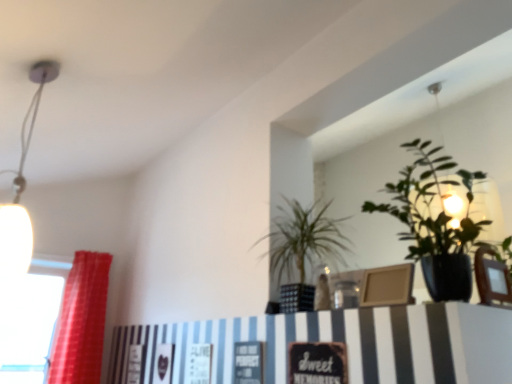
Question: Is red fabric curtain at left taller or shorter than transparent glass window at left?

Choices:
 (A) short
 (B) tall

Answer: (B)

Question: From a real-world perspective, is red fabric curtain at left physically located above or below transparent glass window at left?

Choices:
 (A) below
 (B) above

Answer: (B)

Question: Estimate the real-world distances between objects in this image. Which object is closer to the green glossy plant at upper right, arranged as the 2th houseplant when viewed from the left?

Choices:
 (A) transparent glass window at left
 (B) white glossy lamp at upper left
 (C) green leafy plant at center, the second houseplant from the right
 (D) red fabric curtain at left

Answer: (C)

Question: Based on their relative distances, which object is nearer to the red fabric curtain at left?

Choices:
 (A) green leafy plant at center, the first houseplant from the left
 (B) green glossy plant at upper right, which ranks as the first houseplant in right-to-left order
 (C) transparent glass window at left
 (D) white glossy lamp at upper left

Answer: (C)